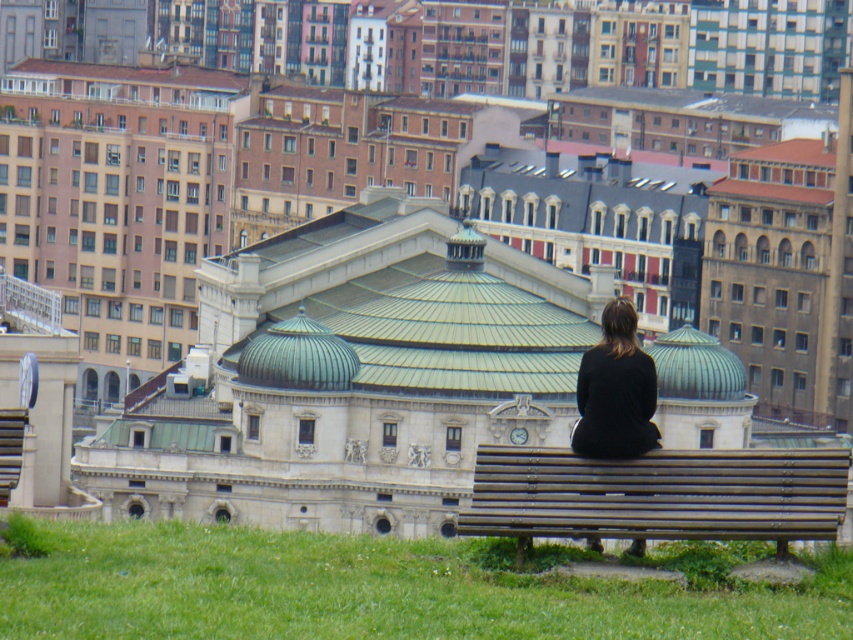
You are a photographer standing at the center of the scene wanting to capture both the brown wooden bench at lower right and the black matte dress at lower right in the same frame. Given that your camera has a fixed focal length that can only cover a maximum distance of 3 meters between subjects, will you be able to include both in your photo?

The brown wooden bench at lower right and the black matte dress at lower right are 2.86 meters apart from each other. Since the maximum distance your camera can cover is 3 meters, you can include both in your photo as 2.86 meters is less than 3 meters.

You are a photographer trying to capture a photo of the historic building in the background. You notice the brown wooden bench at lower right and the black matte dress at lower right might block your view. Which object is shorter and therefore less likely to obstruct your shot?

The brown wooden bench at lower right is not as tall as the black matte dress at lower right, so the bench is shorter and less likely to obstruct your shot.

You are a photographer trying to capture the historic building in the background. You notice the brown wooden bench at lower right and the black matte dress at lower right might block the view. Which object is closer to the camera and thus more likely to obstruct the view of the building?

The brown wooden bench at lower right is located below the black matte dress at lower right, meaning it is closer to the camera. Therefore, the brown wooden bench at lower right is more likely to obstruct the view of the historic building.